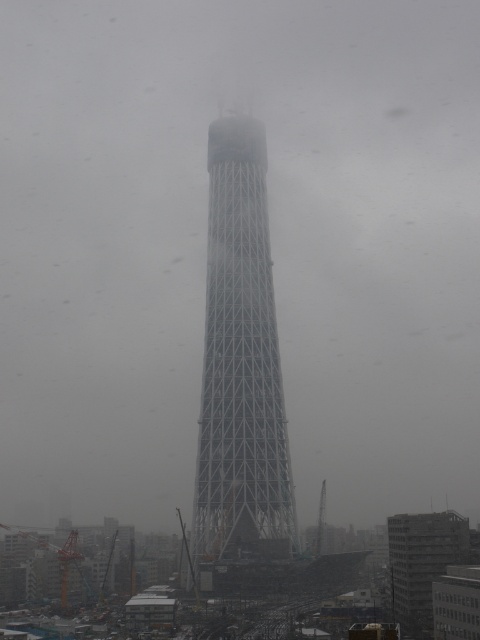
Based on the scene description, which object is wider between the metallic lattice tower at center and the white metallic tower at center?

The metallic lattice tower at center is wider than the white metallic tower at center according to the description.

You are standing at a viewpoint near the Tokyo Skytree and want to know how far you are from the point marked at coordinates point (207, 328). Can you determine the distance?

The distance between you and the point (207, 328) is 250.95 meters.

You are a drone operator tasked with capturing aerial footage of the metallic lattice tower at center. The drone must maintain a safe distance of at least 100 meters from the tower. Based on the coordinates provided in the description, can you determine if the drone is within the required safety zone?

The metallic lattice tower at center is located at point [240,364]. However, without specific coordinates for the drone or a scale reference, it is impossible to determine if the drone is within the required 100 meter safety zone. Additional information is needed to make this calculation.